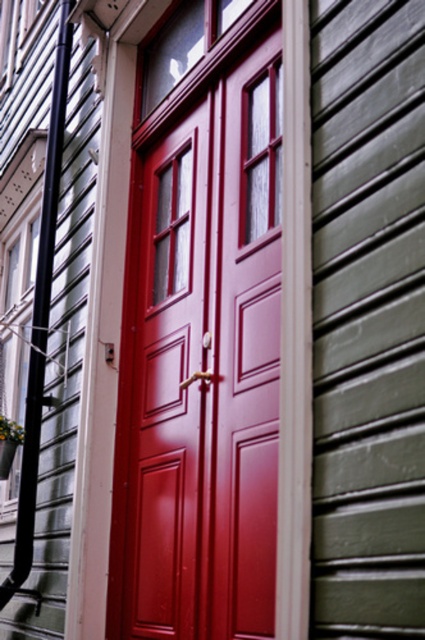
Is glossy wood door at center thinner than green painted wood siding at right?

Incorrect, glossy wood door at center's width is not less than green painted wood siding at right's.

Does glossy wood door at center appear on the right side of green painted wood siding at right?

Incorrect, glossy wood door at center is not on the right side of green painted wood siding at right.

The image size is (425, 640). What do you see at coordinates (201, 333) in the screenshot?
I see `glossy wood door at center` at bounding box center [201, 333].

Where is `glossy wood door at center`? This screenshot has height=640, width=425. glossy wood door at center is located at coordinates (201, 333).

Is point (340, 196) positioned behind point (48, 170)?

No, (340, 196) is closer to viewer.

Between point (343, 83) and point (64, 61), which one is positioned behind?

Positioned behind is point (64, 61).

I want to click on green painted wood siding at right, so click(368, 317).

Does glossy wood door at center have a greater width compared to black plastic pipe at left?

Yes, glossy wood door at center is wider than black plastic pipe at left.

Does glossy wood door at center have a lesser width compared to black plastic pipe at left?

In fact, glossy wood door at center might be wider than black plastic pipe at left.

Who is more forward, (x=260, y=627) or (x=42, y=301)?

Point (x=260, y=627) is more forward.

The image size is (425, 640). In order to click on glossy wood door at center in this screenshot , I will do `click(201, 333)`.